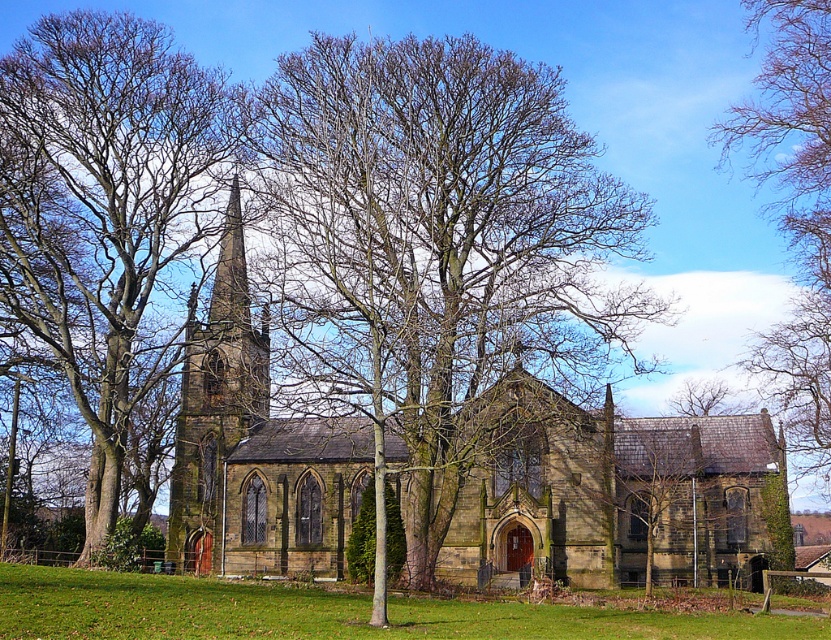
Question: Does bare branches at center come in front of bare branches at upper right?

Choices:
 (A) yes
 (B) no

Answer: (A)

Question: Is bare branches at center further to camera compared to bare branches at upper right?

Choices:
 (A) yes
 (B) no

Answer: (B)

Question: Which point is farther to the camera?

Choices:
 (A) (234, 294)
 (B) (471, 420)

Answer: (A)

Question: Which object is the closest to the brown bark tree at left?

Choices:
 (A) brown stone tower at center
 (B) bare branches at upper right

Answer: (A)

Question: Which object is farther from the camera taking this photo?

Choices:
 (A) brown stone tower at center
 (B) bare branches at center

Answer: (A)

Question: Is brown bark tree at left smaller than bare branches at upper right?

Choices:
 (A) yes
 (B) no

Answer: (B)